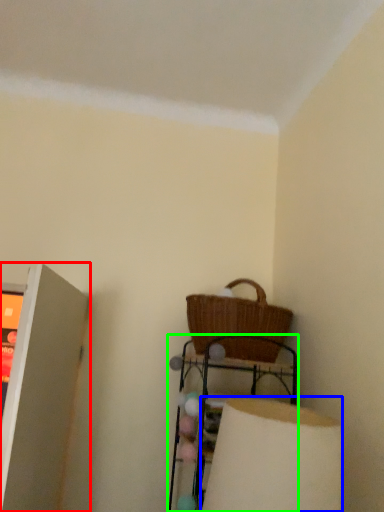
Question: Which is nearer to the shelf (highlighted by a red box)? lamp (highlighted by a blue box) or furniture (highlighted by a green box).

Choices:
 (A) lamp
 (B) furniture

Answer: (B)